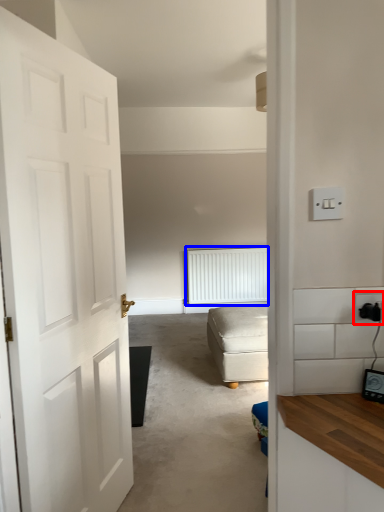
Question: Which object appears closest to the camera in this image, electric outlet (highlighted by a red box) or radiator (highlighted by a blue box)?

Choices:
 (A) electric outlet
 (B) radiator

Answer: (A)